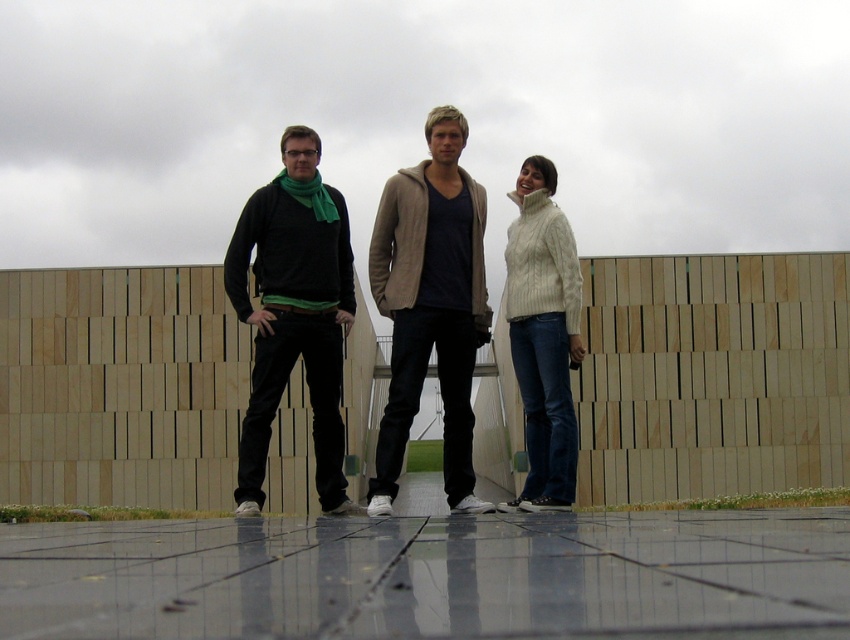
You are standing in the same location as the photographer who took this image. You want to know where the matte black pants at center are located in the image. Can you tell me their position using coordinates?

The matte black pants at center are located at coordinates point (429, 304).

Looking at this image, you are a fashion designer analyzing the outfit of the person in the center. Do the matte black sweater at center and the matte black pants at center form a vertical line when viewed from above?

Yes, the matte black pants at center is below the matte black sweater at center, so they form a vertical line when viewed from above.